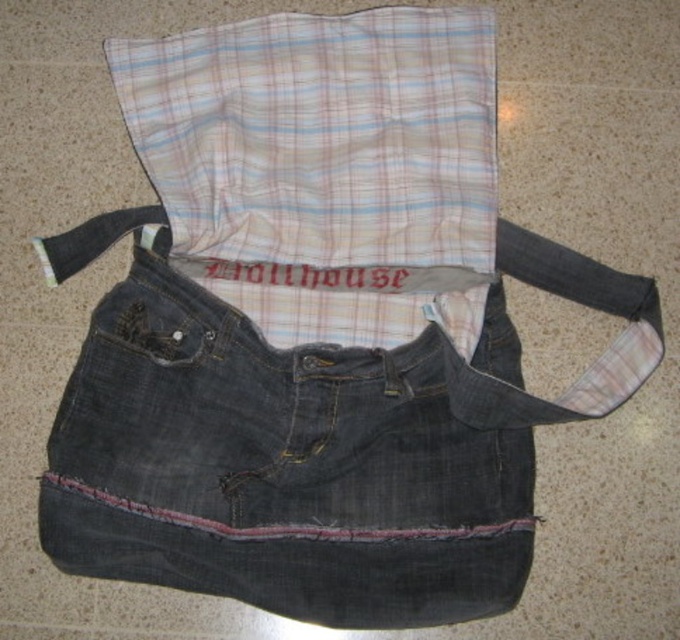
Between denim at center and denim strap at center, which one appears on the right side from the viewer's perspective?

denim strap at center

Which is behind, point (428, 497) or point (617, 284)?

Point (617, 284)

Is point (492, 406) less distant than point (466, 392)?

Yes, it is in front of point (466, 392).

Image resolution: width=680 pixels, height=640 pixels. Identify the location of denim at center. (311, 442).

Which is more to the right, denim at center or plaid fabric at center?

Positioned to the right is plaid fabric at center.

Is denim at center to the right of plaid fabric at center from the viewer's perspective?

Incorrect, denim at center is not on the right side of plaid fabric at center.

What do you see at coordinates (311, 442) in the screenshot? The width and height of the screenshot is (680, 640). I see `denim at center` at bounding box center [311, 442].

At what (x,y) coordinates should I click in order to perform the action: click on denim at center. Please return your answer as a coordinate pair (x, y). Image resolution: width=680 pixels, height=640 pixels. Looking at the image, I should click on (311, 442).

Based on the photo, is plaid fabric at center closer to the viewer compared to denim strap at center?

No, it is not.

Which is below, plaid fabric at center or denim strap at center?

Positioned lower is denim strap at center.

This screenshot has width=680, height=640. What do you see at coordinates (324, 168) in the screenshot?
I see `plaid fabric at center` at bounding box center [324, 168].

Identify the location of plaid fabric at center. pyautogui.click(x=324, y=168).